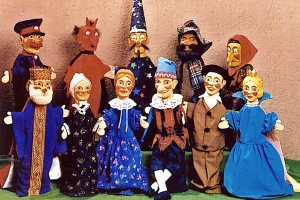
This screenshot has height=200, width=300. I want to click on pink wall background, so click(x=280, y=39).